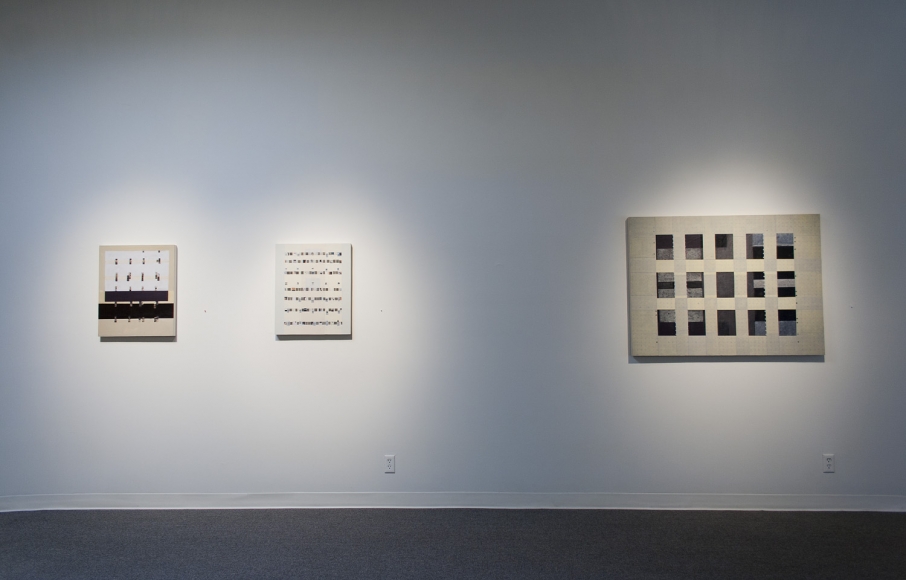
Find the location of a particular element. The image size is (906, 580). top edges of canvases is located at coordinates (302, 244), (130, 246), (740, 213).